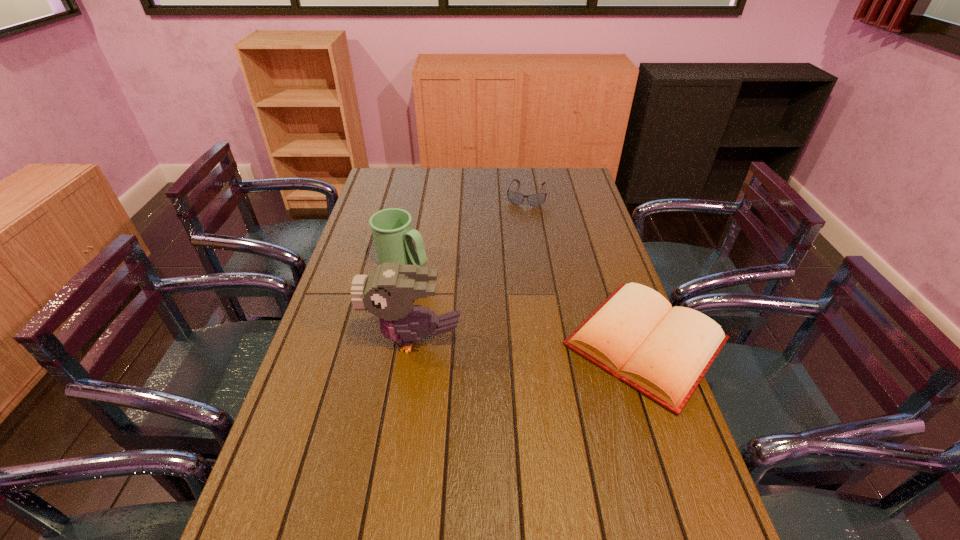
The width and height of the screenshot is (960, 540). What are the coordinates of `vacant area that lies between the Bible and the third shortest object` in the screenshot? It's located at (524, 302).

This screenshot has width=960, height=540. Identify the location of vacant point located between the sunglasses and the Bible. point(587,268).

Find the location of a particular element. free spot between the Bible and the tallest object is located at coordinates (530, 341).

Find the location of a particular element. The image size is (960, 540). vacant region between the bird and the farthest object is located at coordinates (470, 267).

At what (x,y) coordinates should I click in order to perform the action: click on object that is the third closest to the third shortest object. Please return your answer as a coordinate pair (x, y). The height and width of the screenshot is (540, 960). Looking at the image, I should click on (663, 352).

Locate which object ranks second in proximity to the farthest object. Please provide its 2D coordinates. Your answer should be formatted as a tuple, i.e. [(x, y)], where the tuple contains the x and y coordinates of a point satisfying the conditions above.

[(663, 352)]

Find the location of a particular element. The height and width of the screenshot is (540, 960). free space that satisfies the following two spatial constraints: 1. on the front side of the bird; 2. at the beak of the mug is located at coordinates (387, 340).